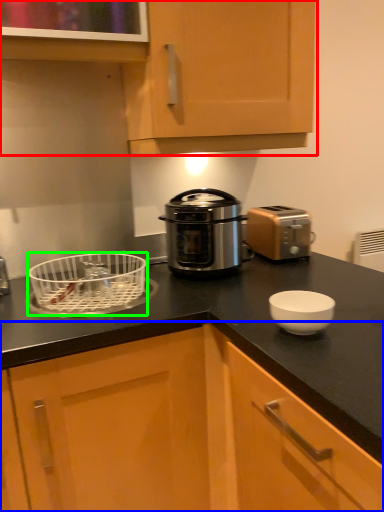
Question: Which object is the farthest from cabinetry (highlighted by a red box)? Choose among these: cabinetry (highlighted by a blue box) or kitchen appliance (highlighted by a green box).

Choices:
 (A) cabinetry
 (B) kitchen appliance

Answer: (A)